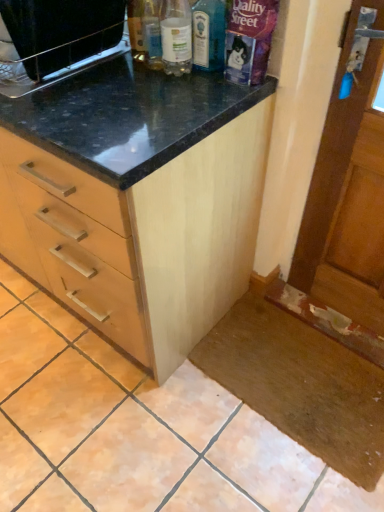
Find the location of a particular element. free region on the left part of translucent glass bottle at center, placed as the second bottle when sorted from left to right is located at coordinates (132, 77).